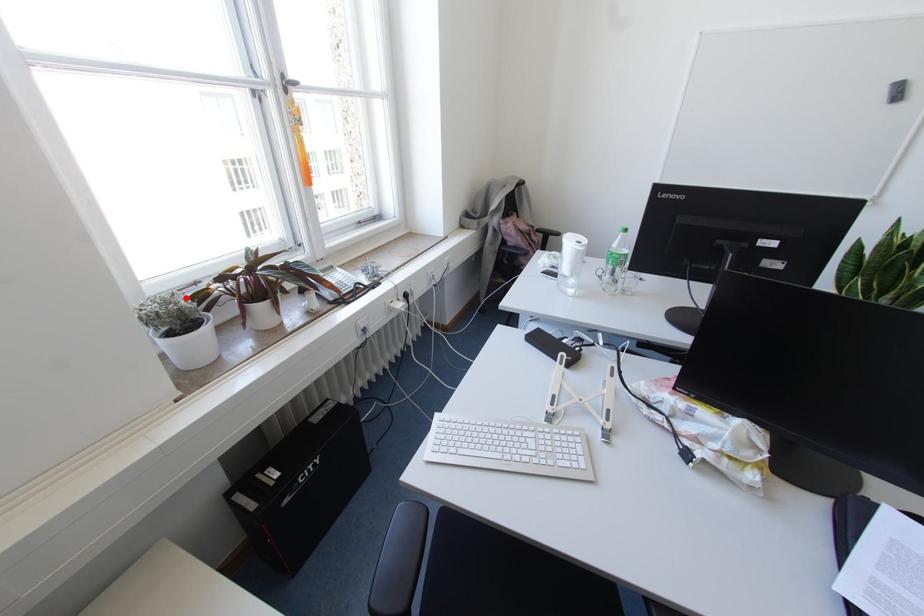
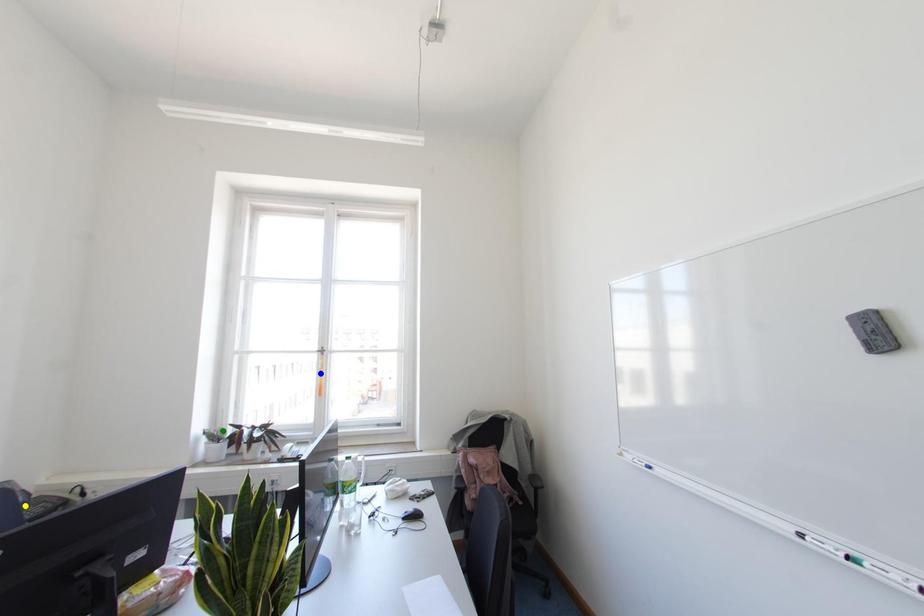
Question: I am providing you with two images of the same scene from different viewpoints. A red point is marked on the first image. You are given multiple points on the second image. Which point in image 2 is actually the same real-world point as the red point in image 1?

Choices:
 (A) yellow point
 (B) blue point
 (C) green point

Answer: (C)